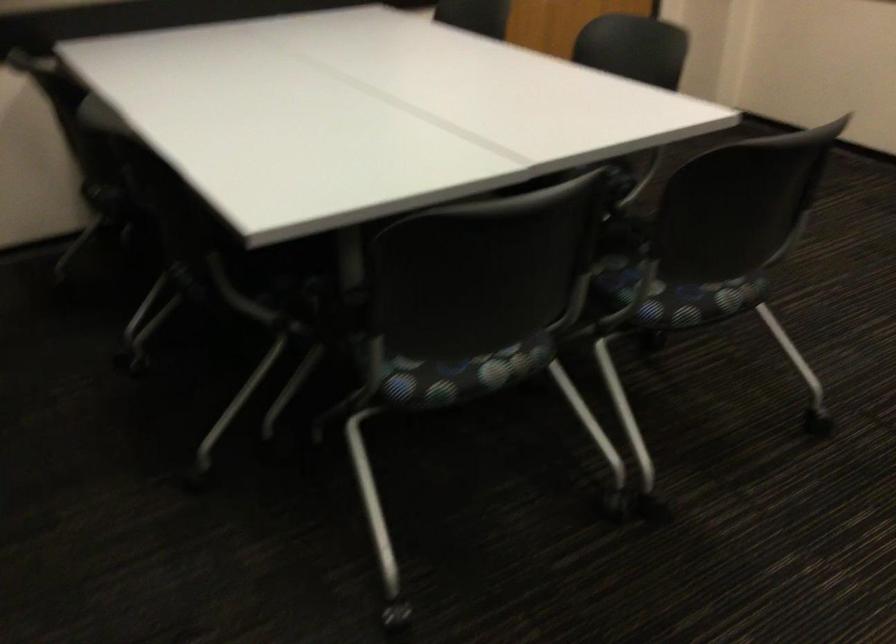
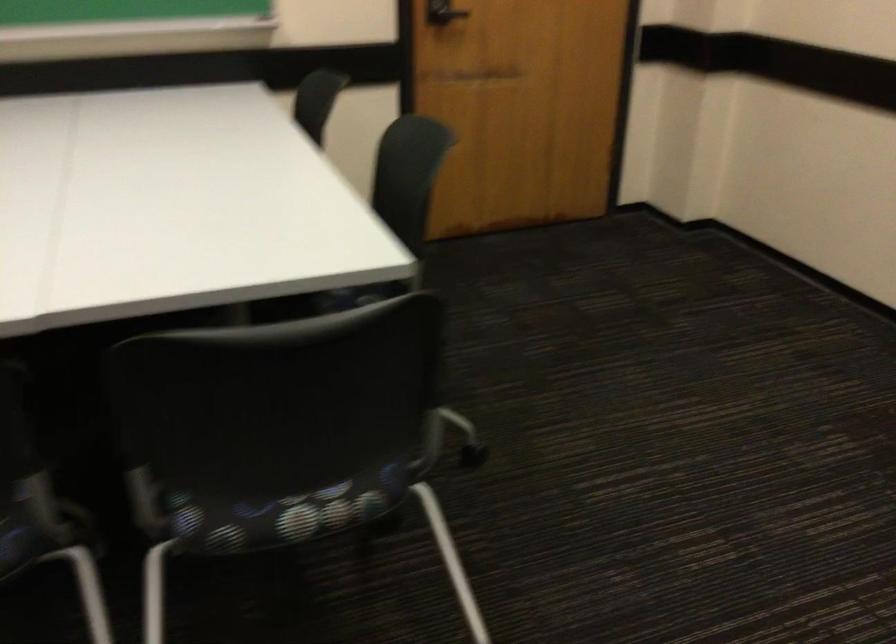
In the second image, find the point that corresponds to point 719,299 in the first image.

(286, 514)